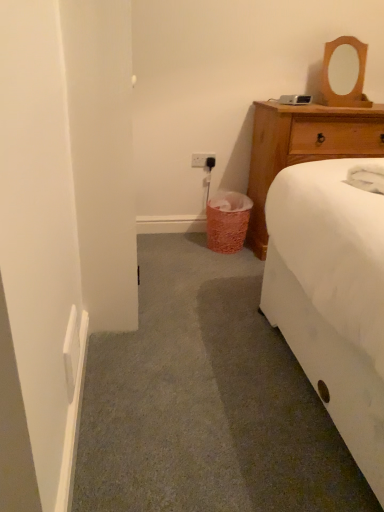
Question: Does white plastic power outlet at center have a greater height compared to pink textured trash can at lower center?

Choices:
 (A) no
 (B) yes

Answer: (A)

Question: Does white plastic power outlet at center appear on the right side of pink textured trash can at lower center?

Choices:
 (A) yes
 (B) no

Answer: (B)

Question: Considering the relative positions of white plastic power outlet at center and pink textured trash can at lower center in the image provided, is white plastic power outlet at center to the left of pink textured trash can at lower center from the viewer's perspective?

Choices:
 (A) yes
 (B) no

Answer: (A)

Question: Are white plastic power outlet at center and pink textured trash can at lower center making contact?

Choices:
 (A) no
 (B) yes

Answer: (A)

Question: Does white plastic power outlet at center have a greater width compared to pink textured trash can at lower center?

Choices:
 (A) yes
 (B) no

Answer: (B)

Question: From a real-world perspective, is white plastic power outlet at center positioned over pink textured trash can at lower center based on gravity?

Choices:
 (A) no
 (B) yes

Answer: (B)

Question: From a real-world perspective, is white plastic power outlet at center positioned under wooden dresser at upper right based on gravity?

Choices:
 (A) no
 (B) yes

Answer: (A)

Question: Does white plastic power outlet at center have a greater width compared to wooden dresser at upper right?

Choices:
 (A) yes
 (B) no

Answer: (B)

Question: From the image's perspective, is white plastic power outlet at center located beneath wooden dresser at upper right?

Choices:
 (A) no
 (B) yes

Answer: (A)

Question: Does white plastic power outlet at center have a larger size compared to wooden dresser at upper right?

Choices:
 (A) yes
 (B) no

Answer: (B)

Question: Considering the relative sizes of white plastic power outlet at center and wooden dresser at upper right in the image provided, is white plastic power outlet at center shorter than wooden dresser at upper right?

Choices:
 (A) no
 (B) yes

Answer: (B)

Question: Is white plastic power outlet at center positioned far away from wooden dresser at upper right?

Choices:
 (A) no
 (B) yes

Answer: (A)

Question: From a real-world perspective, is wooden mirror at upper right on top of wooden dresser at upper right?

Choices:
 (A) yes
 (B) no

Answer: (A)